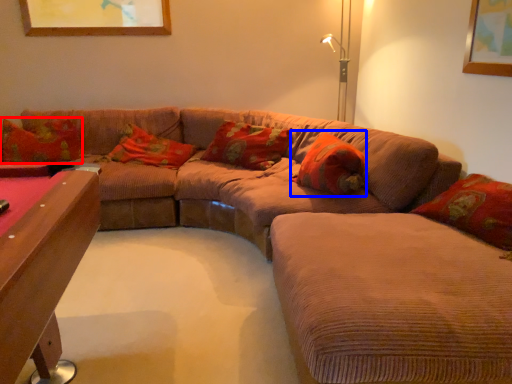
Question: Which object appears farthest to the camera in this image, pillow (highlighted by a red box) or pillow (highlighted by a blue box)?

Choices:
 (A) pillow
 (B) pillow

Answer: (A)